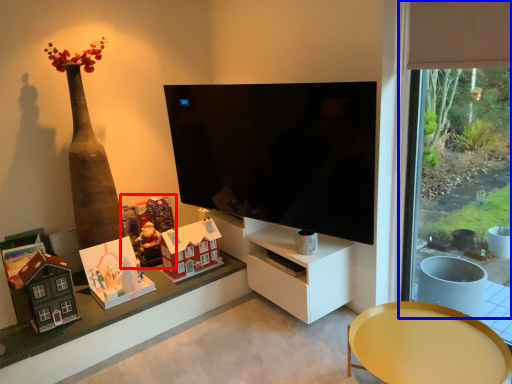
Question: Which object is closer to the camera taking this photo, toy (highlighted by a red box) or window frame (highlighted by a blue box)?

Choices:
 (A) toy
 (B) window frame

Answer: (B)